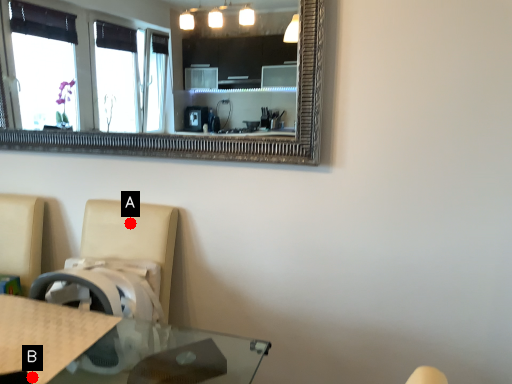
Question: Two points are circled on the image, labeled by A and B beside each circle. Which point is farther to the camera?

Choices:
 (A) A is further
 (B) B is further

Answer: (A)